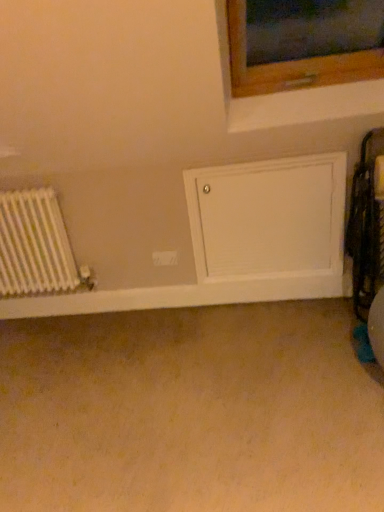
Question: Considering the relative sizes of white metallic radiator at left and white matte door at center in the image provided, is white metallic radiator at left thinner than white matte door at center?

Choices:
 (A) no
 (B) yes

Answer: (A)

Question: Would you say white metallic radiator at left is outside white matte door at center?

Choices:
 (A) yes
 (B) no

Answer: (A)

Question: Is white metallic radiator at left facing away from white matte door at center?

Choices:
 (A) yes
 (B) no

Answer: (B)

Question: Does white metallic radiator at left have a smaller size compared to white matte door at center?

Choices:
 (A) yes
 (B) no

Answer: (B)

Question: From a real-world perspective, is white metallic radiator at left positioned under white matte door at center based on gravity?

Choices:
 (A) no
 (B) yes

Answer: (A)

Question: Is white matte door at lower center in front of or behind white metallic radiator at left in the image?

Choices:
 (A) front
 (B) behind

Answer: (B)

Question: In terms of size, does white matte door at lower center appear bigger or smaller than white metallic radiator at left?

Choices:
 (A) small
 (B) big

Answer: (A)

Question: Do you think white matte door at lower center is within white metallic radiator at left, or outside of it?

Choices:
 (A) inside
 (B) outside

Answer: (B)

Question: Considering the positions of white matte door at lower center and white metallic radiator at left in the image, is white matte door at lower center wider or thinner than white metallic radiator at left?

Choices:
 (A) wide
 (B) thin

Answer: (B)

Question: From a real-world perspective, is white metallic radiator at left physically located above or below white matte door at lower center?

Choices:
 (A) above
 (B) below

Answer: (A)

Question: Considering the positions of white metallic radiator at left and white matte door at lower center in the image, is white metallic radiator at left wider or thinner than white matte door at lower center?

Choices:
 (A) wide
 (B) thin

Answer: (A)

Question: From the image's perspective, is white metallic radiator at left above or below white matte door at lower center?

Choices:
 (A) above
 (B) below

Answer: (A)

Question: Is white metallic radiator at left taller or shorter than white matte door at lower center?

Choices:
 (A) tall
 (B) short

Answer: (A)

Question: Would you say white matte door at lower center is inside or outside white plastic electric outlet at center?

Choices:
 (A) outside
 (B) inside

Answer: (A)

Question: In terms of width, does white matte door at lower center look wider or thinner when compared to white plastic electric outlet at center?

Choices:
 (A) thin
 (B) wide

Answer: (B)